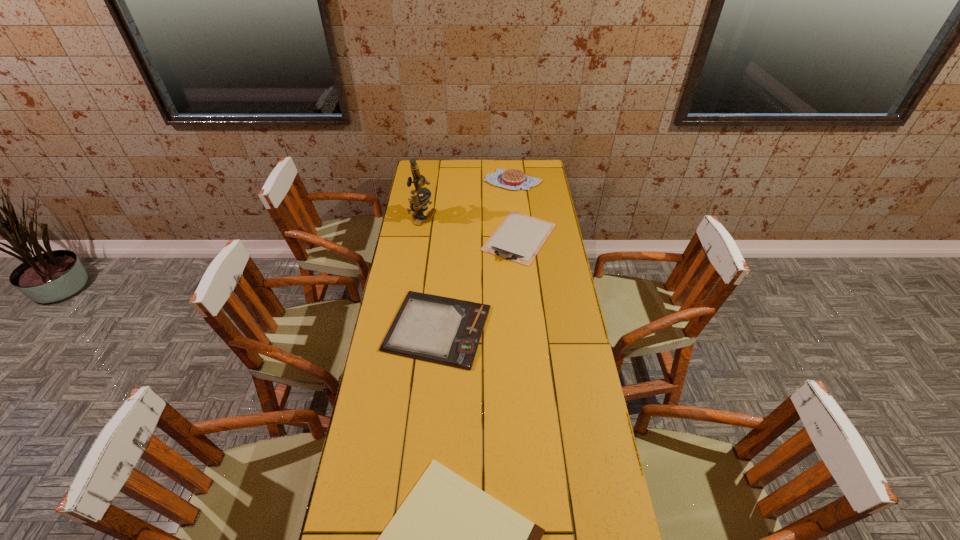
What are the coordinates of `empty location between the farthest clipboard and the second nearest object` in the screenshot? It's located at (478, 282).

This screenshot has width=960, height=540. What are the coordinates of `vacant area that lies between the farthest clipboard and the second farthest clipboard` in the screenshot? It's located at (478, 282).

Where is `vacant space that is in between the second nearest object and the microscope`? vacant space that is in between the second nearest object and the microscope is located at coordinates (430, 273).

Locate an element on the screen. This screenshot has width=960, height=540. empty location between the farthest clipboard and the farthest object is located at coordinates (516, 209).

Image resolution: width=960 pixels, height=540 pixels. I want to click on empty space that is in between the tallest object and the second farthest clipboard, so click(x=430, y=273).

Identify the location of vacant point located between the tallest object and the farthest clipboard. This screenshot has height=540, width=960. (470, 228).

You are a GUI agent. You are given a task and a screenshot of the screen. Output one action in this format:
    pyautogui.click(x=<x>, y=<y>)
    Task: Click on the vacant area that lies between the second nearest object and the farthest clipboard
    
    Given the screenshot: What is the action you would take?
    pyautogui.click(x=478, y=282)

Locate an element on the screen. Image resolution: width=960 pixels, height=540 pixels. the fourth closest object to the farthest clipboard is located at coordinates 449,539.

Image resolution: width=960 pixels, height=540 pixels. What are the coordinates of `object identified as the second closest to the nearest object` in the screenshot? It's located at (519, 237).

Image resolution: width=960 pixels, height=540 pixels. What are the coordinates of `clipboard that stands as the closest to the nearest clipboard` in the screenshot? It's located at (447, 331).